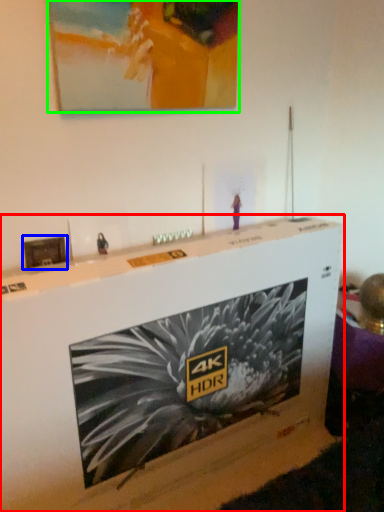
Question: Which object is positioned farthest from furniture (highlighted by a red box)? Select from picture frame (highlighted by a blue box) and picture frame (highlighted by a green box).

Choices:
 (A) picture frame
 (B) picture frame

Answer: (B)